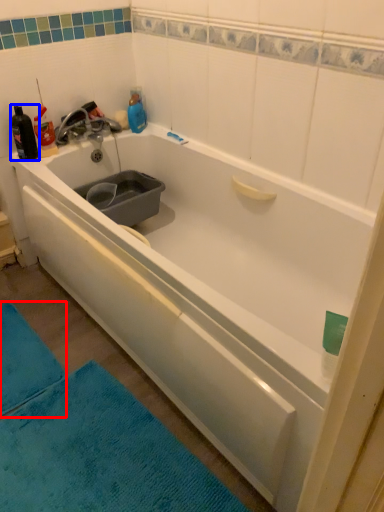
Question: Among these objects, which one is nearest to the camera, bath mat (highlighted by a red box) or bottle (highlighted by a blue box)?

Choices:
 (A) bath mat
 (B) bottle

Answer: (A)